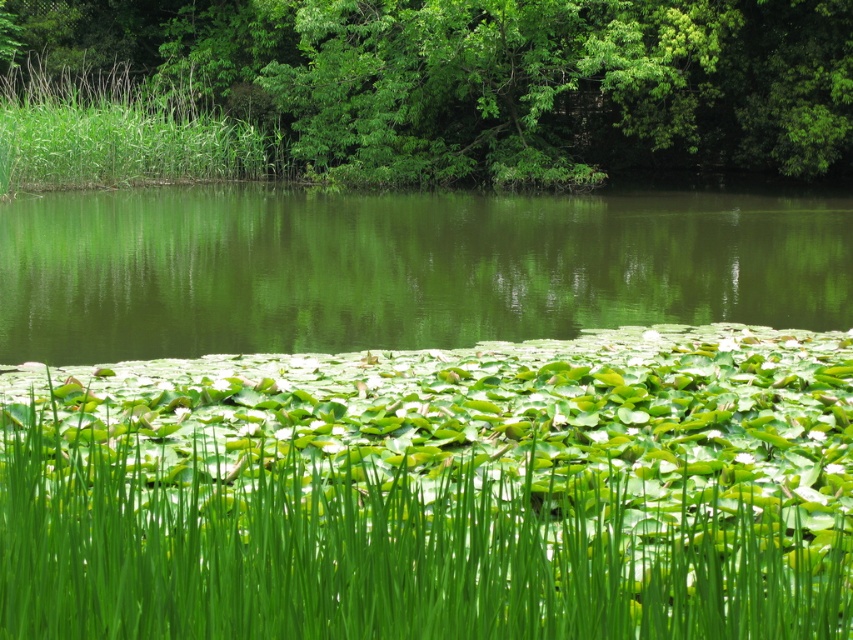
You are standing at the edge of the water and see the green grass at bottom and the green leafy tree at upper center. Which object is positioned to the right of the other?

The green grass at bottom is to the right of green leafy tree at upper center.

You are standing in the serene natural scene and want to place a small marker at each of the two points labeled point [461,435] and point [526,180]. Which point will appear larger in your view?

Point [461,435] is closer to the camera than point [526,180], so it will appear larger in your view.

Consider the image. You are a small frog trying to jump from the green grass at bottom to the green leafy tree at upper center. Can you reach the tree from the grass?

The green grass at bottom has a lesser height compared to green leafy tree at upper center, so the frog cannot reach the tree from the grass because the grass is shorter than the tree.